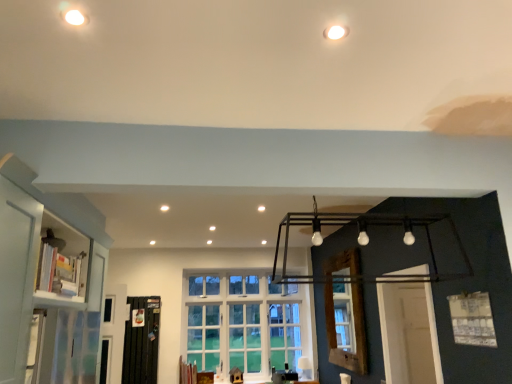
Question: Considering the relative positions of white glossy bookshelf at left and white glass window at center, which is the 2th window in right-to-left order, in the image provided, is white glossy bookshelf at left to the left or to the right of white glass window at center, which is the 2th window in right-to-left order,?

Choices:
 (A) right
 (B) left

Answer: (B)

Question: From a real-world perspective, is white glossy bookshelf at left physically located above or below white glass window at center, which is the 2th window in right-to-left order?

Choices:
 (A) above
 (B) below

Answer: (A)

Question: Which of these objects is positioned farthest from the white glossy bookshelf at left?

Choices:
 (A) black metal screen door at lower left
 (B) white glass window at center, marked as the second window in a top-to-bottom arrangement
 (C) wooden window frame at center
 (D) white glossy bookshelf at left
 (E) white matte window at upper center, arranged as the first window when viewed from the right

Answer: (B)

Question: Based on their relative distances, which object is nearer to the white glossy bookshelf at left?

Choices:
 (A) black metal screen door at lower left
 (B) white glass window at center, the first window in the left-to-right sequence
 (C) wooden window frame at center
 (D) white glossy bookshelf at left
 (E) white matte window at upper center, which is the first window from top to bottom

Answer: (D)